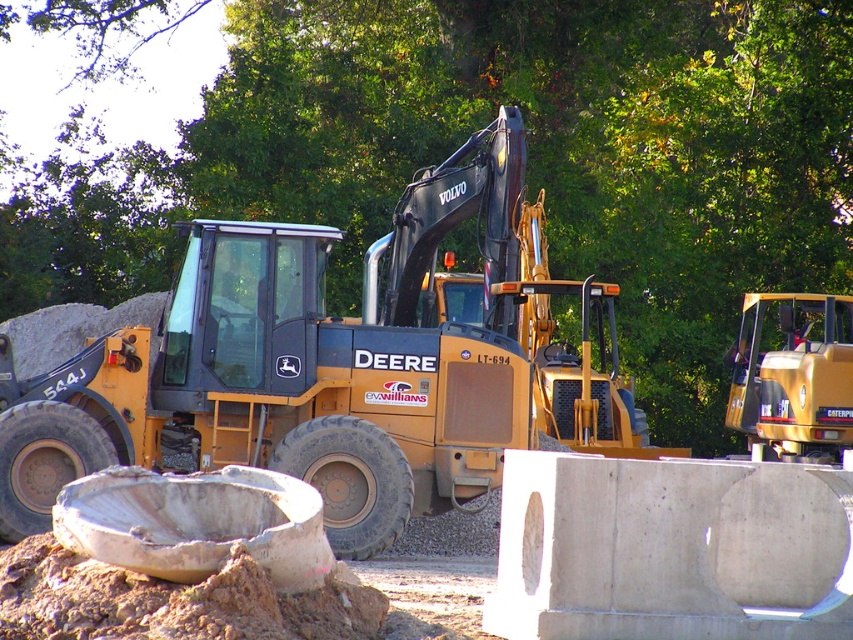
Question: In this image, where is yellow metallic excavator at center located relative to brown sandy dirt at lower left?

Choices:
 (A) above
 (B) below

Answer: (A)

Question: Based on their relative distances, which object is farther from the yellow metallic excavator at center?

Choices:
 (A) brown sandy dirt at lower left
 (B) yellow metallic tractor at right
 (C) gray concrete at center

Answer: (A)

Question: Which of these objects is positioned farthest from the yellow metallic tractor at right?

Choices:
 (A) brown sandy dirt at lower left
 (B) gray concrete at center

Answer: (A)

Question: Does yellow metallic excavator at center appear on the right side of brown sandy dirt at lower left?

Choices:
 (A) yes
 (B) no

Answer: (A)

Question: Which point is closer to the camera taking this photo?

Choices:
 (A) (770, 412)
 (B) (256, 596)
 (C) (512, 342)

Answer: (B)

Question: Does yellow metallic excavator at center appear over gray concrete at center?

Choices:
 (A) no
 (B) yes

Answer: (B)